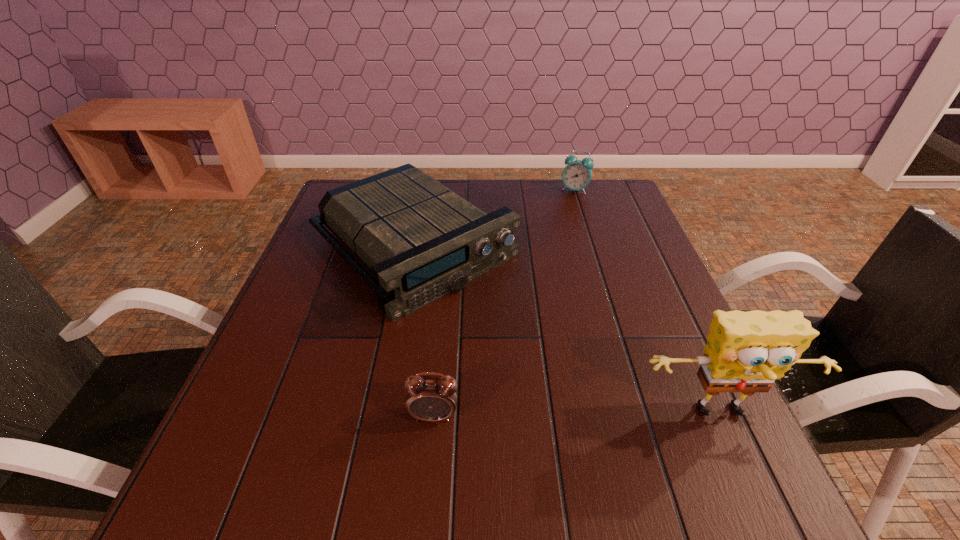
Locate an element on the screen. The width and height of the screenshot is (960, 540). the left alarm clock is located at coordinates (429, 398).

Locate an element on the screen. Image resolution: width=960 pixels, height=540 pixels. sponge is located at coordinates (746, 352).

Locate an element on the screen. The height and width of the screenshot is (540, 960). the farther alarm clock is located at coordinates (576, 175).

I want to click on radio receiver, so click(x=420, y=240).

I want to click on free space located on the face of the farther alarm clock, so click(574, 234).

Image resolution: width=960 pixels, height=540 pixels. I want to click on vacant area situated 0.260m on the face of the farther alarm clock, so click(574, 244).

This screenshot has height=540, width=960. In order to click on vacant space positioned 0.240m on the face of the farther alarm clock in this screenshot , I will do `click(574, 240)`.

You are a GUI agent. You are given a task and a screenshot of the screen. Output one action in this format:
    pyautogui.click(x=<x>, y=<y>)
    Task: Click on the free space located on the front panel of the radio receiver
    Image resolution: width=960 pixels, height=540 pixels.
    Given the screenshot: What is the action you would take?
    pyautogui.click(x=530, y=345)

Where is `free space located 0.050m on the front panel of the radio receiver`? This screenshot has width=960, height=540. free space located 0.050m on the front panel of the radio receiver is located at coordinates (493, 314).

Locate an element on the screen. The width and height of the screenshot is (960, 540). free location located 0.360m on the front panel of the radio receiver is located at coordinates (601, 406).